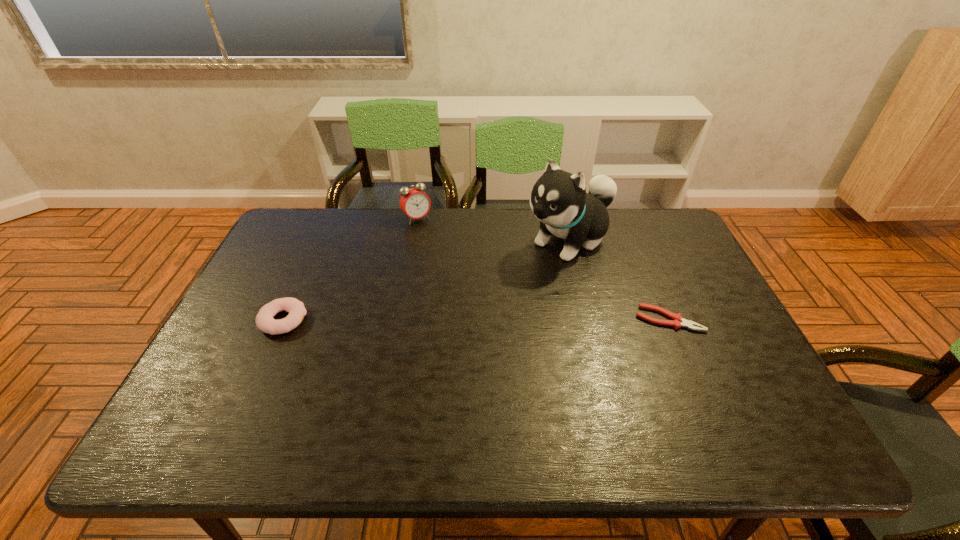
The width and height of the screenshot is (960, 540). I want to click on the third tallest object, so click(x=265, y=322).

This screenshot has width=960, height=540. What are the coordinates of `doughnut` in the screenshot? It's located at (265, 322).

Identify the location of the shortest object. The height and width of the screenshot is (540, 960). (678, 321).

What are the coordinates of `puppy` in the screenshot? It's located at (558, 199).

Where is `the third shortest object`? The height and width of the screenshot is (540, 960). the third shortest object is located at coordinates coord(414,202).

You are a GUI agent. You are given a task and a screenshot of the screen. Output one action in this format:
    pyautogui.click(x=<x>, y=<y>)
    Task: Click on the alarm clock
    The image size is (960, 540).
    Given the screenshot: What is the action you would take?
    pyautogui.click(x=414, y=202)

Identify the location of blank area located on the right of the doughnut. This screenshot has height=540, width=960. (408, 320).

Identify the location of vacant position located 0.380m on the left of the pliers. The width and height of the screenshot is (960, 540). (494, 319).

The image size is (960, 540). I want to click on free space located at the face of the puppy, so click(x=449, y=322).

The image size is (960, 540). Find the location of `vacant space located 0.160m at the face of the puppy`. vacant space located 0.160m at the face of the puppy is located at coordinates pos(504,285).